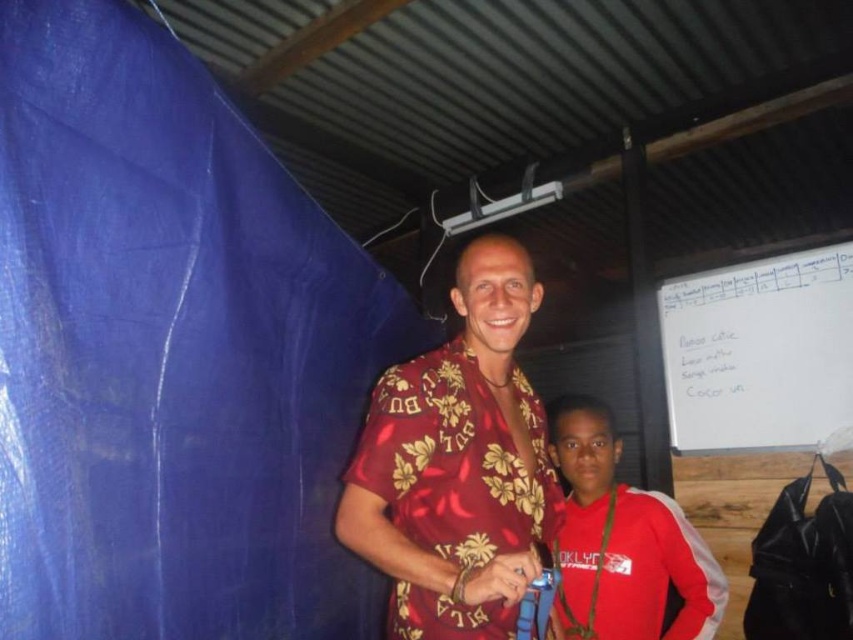
Question: Which of the following is the farthest from the observer?

Choices:
 (A) shiny silk shirt at center
 (B) red satin jacket at lower right

Answer: (B)

Question: Which object is farther from the camera taking this photo?

Choices:
 (A) red satin jacket at lower right
 (B) shiny silk shirt at center

Answer: (A)

Question: Is shiny silk shirt at center to the right of red satin jacket at lower right from the viewer's perspective?

Choices:
 (A) no
 (B) yes

Answer: (A)

Question: Is the position of shiny silk shirt at center less distant than that of red satin jacket at lower right?

Choices:
 (A) yes
 (B) no

Answer: (A)

Question: Which point is closer to the camera?

Choices:
 (A) (671, 538)
 (B) (410, 371)

Answer: (B)

Question: Does shiny silk shirt at center have a greater width compared to red satin jacket at lower right?

Choices:
 (A) no
 (B) yes

Answer: (A)